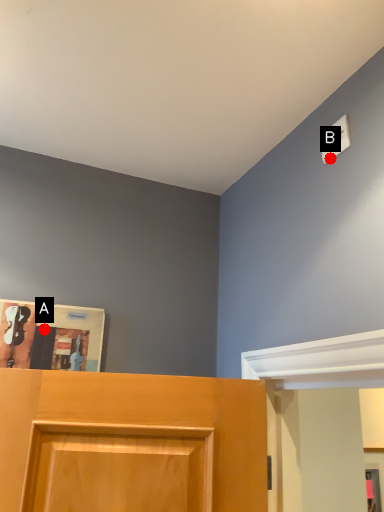
Question: Two points are circled on the image, labeled by A and B beside each circle. Which point appears farthest from the camera in this image?

Choices:
 (A) A is further
 (B) B is further

Answer: (A)